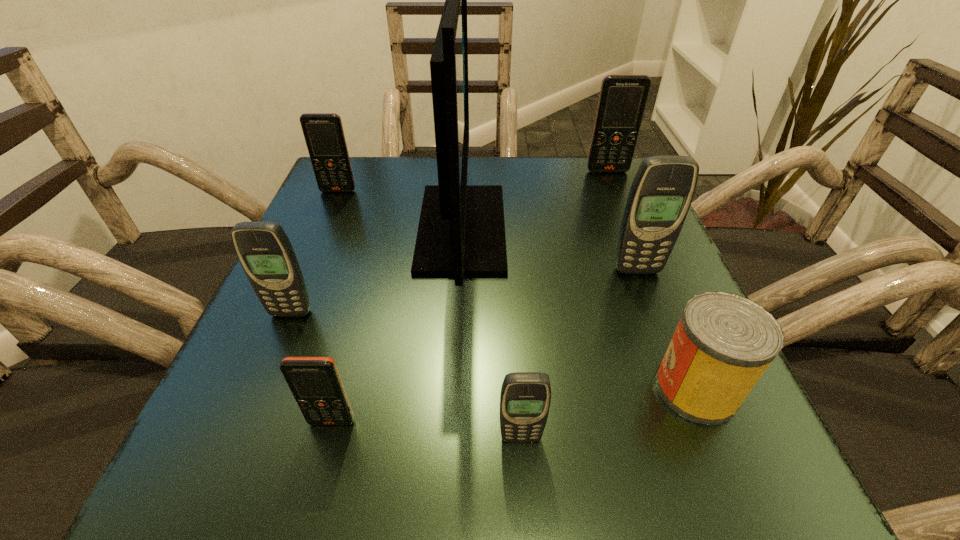
Where is `vacant space at the near left corner of the desktop`? This screenshot has height=540, width=960. vacant space at the near left corner of the desktop is located at coordinates (266, 509).

Where is `vacant point at the far right corner`? This screenshot has width=960, height=540. vacant point at the far right corner is located at coordinates (599, 211).

Find the location of a particular element. The image size is (960, 540). unoccupied area between the smallest gray cellular telephone and the rightmost orange cellular telephone is located at coordinates (564, 305).

The height and width of the screenshot is (540, 960). In order to click on unoccupied position between the leftmost gray cellular telephone and the fifth nearest cellular telephone in this screenshot , I will do `click(315, 252)`.

Image resolution: width=960 pixels, height=540 pixels. What are the coordinates of `empty location between the third cellular telephone from left to right and the smallest gray cellular telephone` in the screenshot? It's located at (426, 430).

Find the location of a particular element. The width and height of the screenshot is (960, 540). vacant region between the farthest gray cellular telephone and the fourth cellular telephone from right to left is located at coordinates (485, 346).

Where is `unoccupied position between the monitor and the fourth cellular telephone from left to right`? The height and width of the screenshot is (540, 960). unoccupied position between the monitor and the fourth cellular telephone from left to right is located at coordinates (492, 333).

Where is `free space between the second gray cellular telephone from left to right and the fourth farthest cellular telephone`? free space between the second gray cellular telephone from left to right and the fourth farthest cellular telephone is located at coordinates (406, 375).

The image size is (960, 540). Identify the location of free area in between the nearest orange cellular telephone and the nearest object. (426, 430).

Where is `free space between the farthest orange cellular telephone and the second farthest orange cellular telephone`? free space between the farthest orange cellular telephone and the second farthest orange cellular telephone is located at coordinates (473, 181).